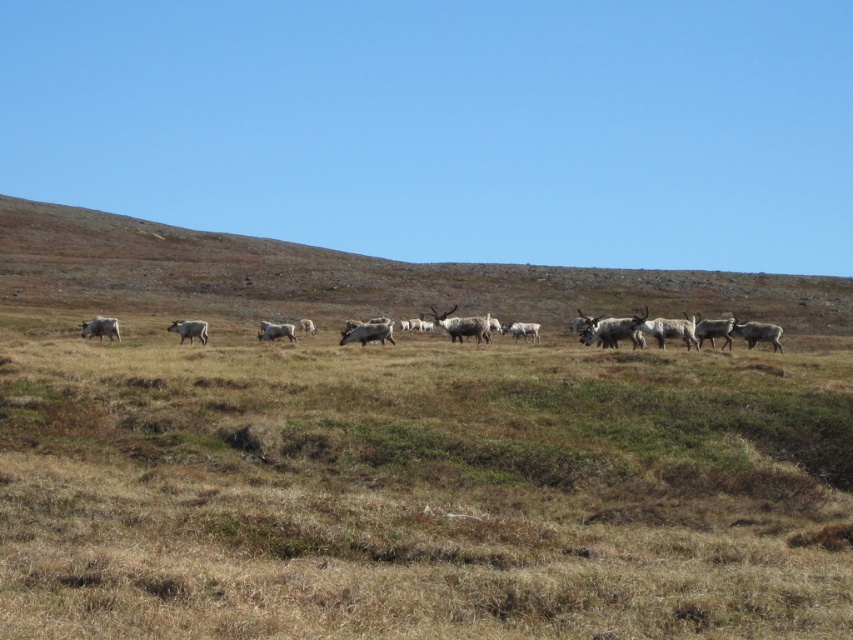
You are standing at the point with coordinates point [196,323] and want to walk to the point with coordinates point [769,337]. According to the scene, will you be moving towards the horizon or away from it?

Point [769,337] is in front of point [196,323], so moving towards the horizon.